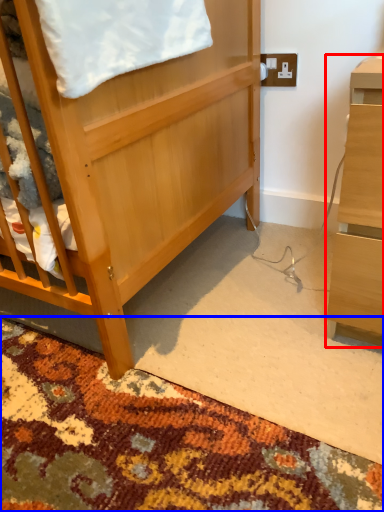
Question: Which object appears closest to the camera in this image, desk (highlighted by a red box) or mat (highlighted by a blue box)?

Choices:
 (A) desk
 (B) mat

Answer: (B)